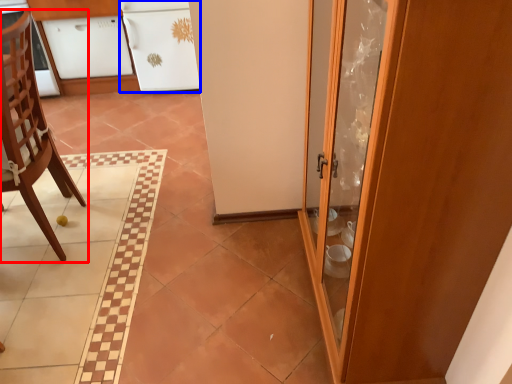
Question: Which object is closer to the camera taking this photo, chair (highlighted by a red box) or cabinetry (highlighted by a blue box)?

Choices:
 (A) chair
 (B) cabinetry

Answer: (A)